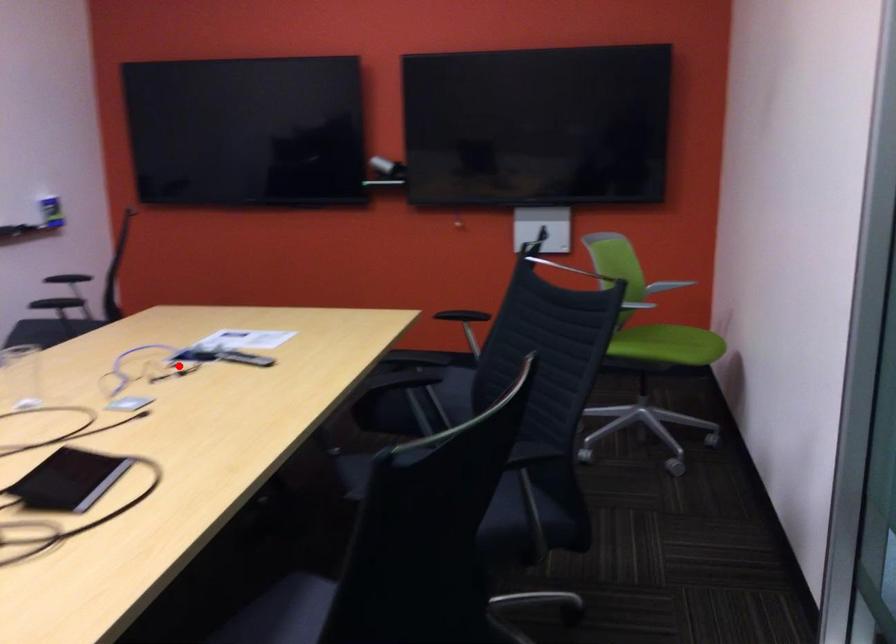
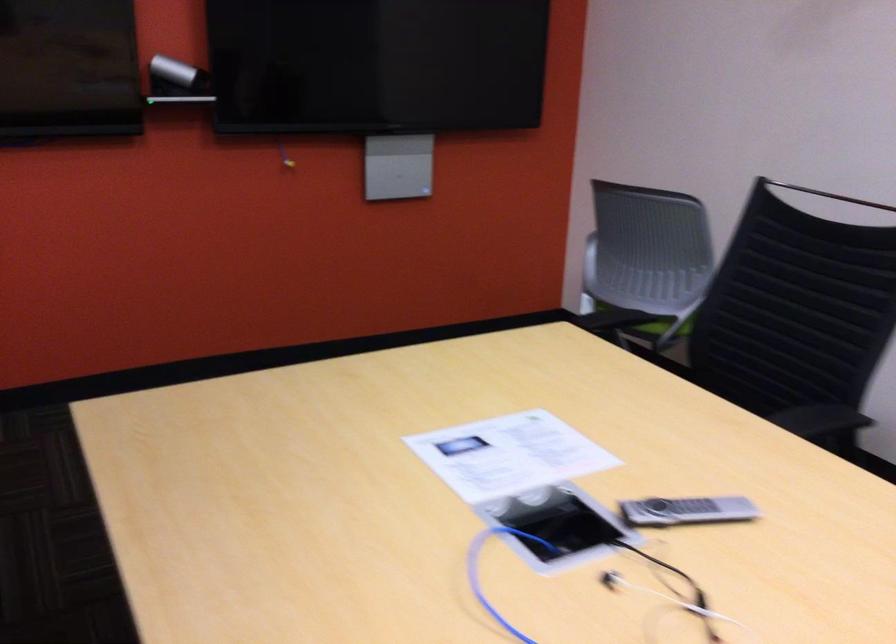
Question: A red point is marked in image1. In image2, is the corresponding 3D point closer to the camera or farther? Reply with the corresponding letter.

Choices:
 (A) The corresponding 3D point is closer.
 (B) The corresponding 3D point is farther.

Answer: (A)